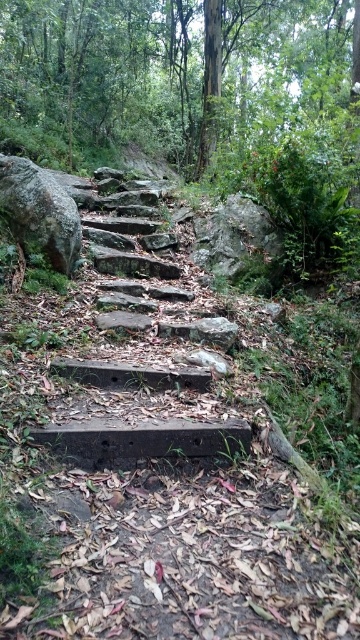
Consider the image. You are a hiker navigating the rustic stone staircase in the forest. You notice two rough gray rocks on the path ahead. One is labeled as the rough gray rock at left and the other as the gray rough rock at center. Which rock should you step on first to follow the safest path?

You should step on the rough gray rock at left first because it is closer to the viewer and part of the immediate path, making it the next step in the staircase sequence.

You are a hiker trying to navigate the forest path. You see the brown concrete stairs at center and the gray rough rock at center. Which object is positioned to the left when viewed from your perspective?

The brown concrete stairs at center is to the left of gray rough rock at center, so the brown concrete stairs at center is positioned to the left.